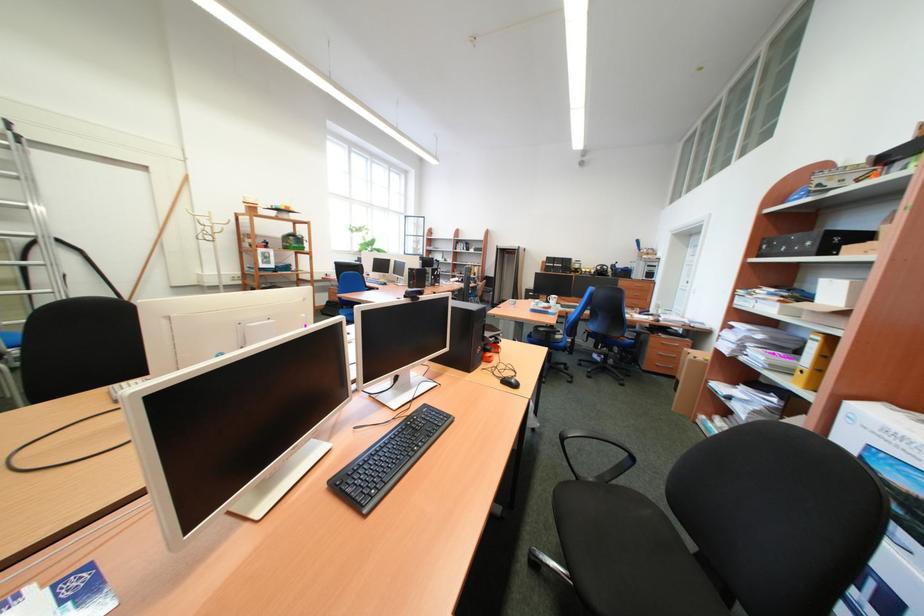
The image size is (924, 616). In order to click on yellow file binder in this screenshot , I will do `click(813, 361)`.